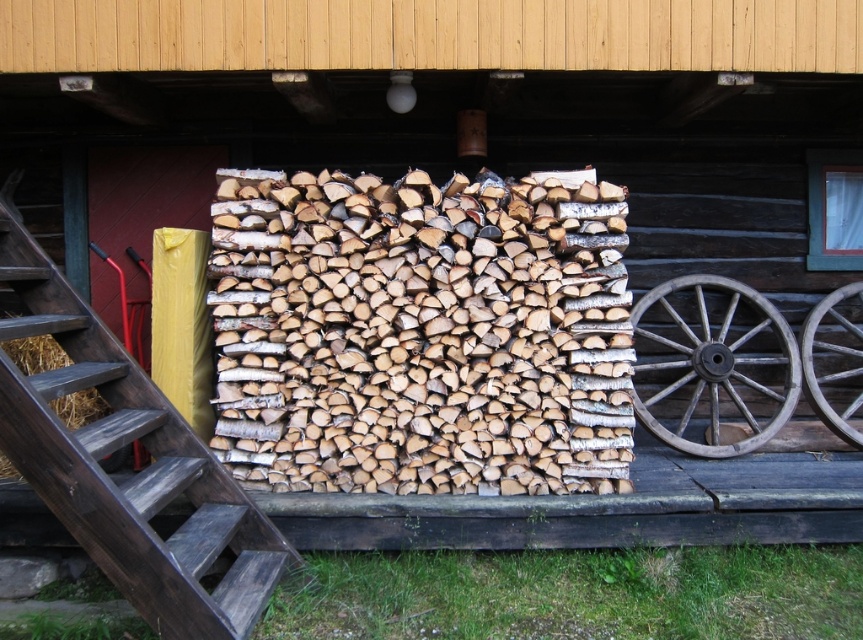
You are standing at the point labeled as point (133, 474) in the image. Looking towards the wooden cabin, which direction should you walk to reach the wooden cabin?

Since the point (133, 474) indicates wooden stairs at left, you should walk towards the right direction to reach the wooden cabin.

Consider the image. You are carrying a large wooden crate that is 1.2 meters wide. You need to move it from the wooden stairs at left to the dark brown wooden wagon wheel at right. Can you move it without turning it sideways?

The wooden stairs at left might be wider than dark brown wooden wagon wheel at right, so it is possible that the stairs can accommodate the crate. However, since the width of the wagon wheel is not specified, there is uncertainty about whether the crate can fit there without turning it sideways. You should check the width of the wagon wheel before moving the crate.

You are standing in front of the cabin and see the dark brown wooden wagon wheel at right and the wooden at right. Which object is positioned to the left?

The dark brown wooden wagon wheel at right is to the left of the wooden at right.